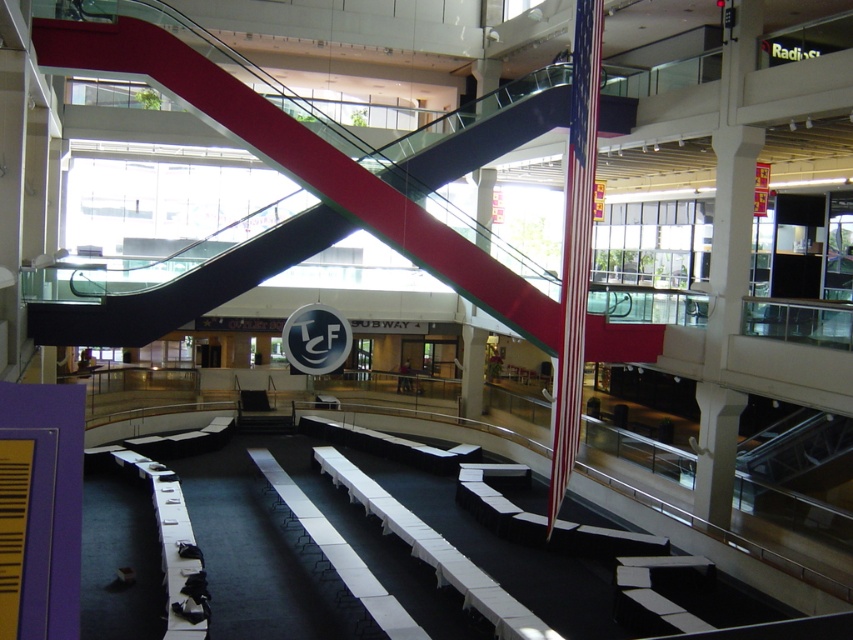
You are attending an event at the mall and need to reach the stage located at the back of the atrium. The metallic escalator at center and the red and white striped pole at center are in your way. Which object should you go around to reach the stage more easily?

The metallic escalator at center is taller than the red and white striped pole at center, so you should go around the red and white striped pole at center to reach the stage more easily.

You are standing at the entrance of the mall and want to reach the information desk located at the center of the atrium. The metallic escalator at center is in your way. Can you walk around it to get to the desk?

The metallic escalator at center is located at point 2D coordinates (189,285). Since the escalator is in the center, you can walk around it either to the left or right side to reach the information desk at the center of the atrium.